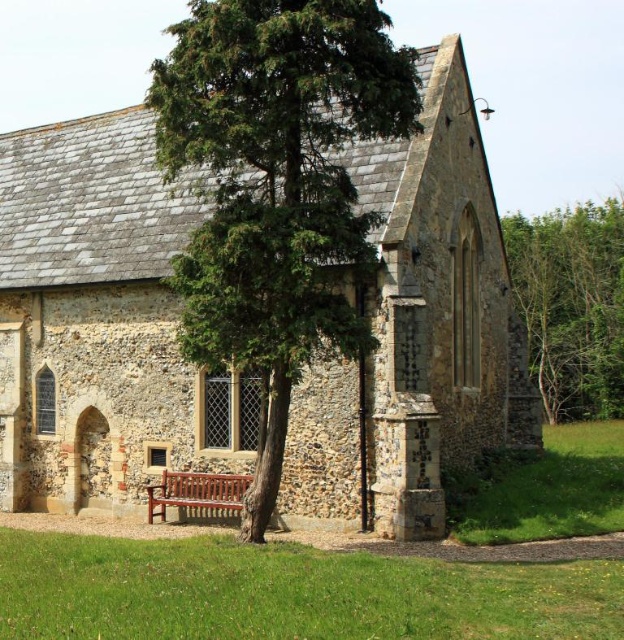
Is green textured tree at center positioned in front of polished wood bench at center?

Yes, it is.

Who is positioned more to the left, green textured tree at center or polished wood bench at center?

From the viewer's perspective, green textured tree at center appears more on the left side.

Identify the location of green textured tree at center. (276, 188).

Can you confirm if green textured tree at center is smaller than green leafy tree at right?

No, green textured tree at center is not smaller than green leafy tree at right.

Is the position of green textured tree at center more distant than that of green leafy tree at right?

No, it is not.

You are a GUI agent. You are given a task and a screenshot of the screen. Output one action in this format:
    pyautogui.click(x=<x>, y=<y>)
    Task: Click on the green textured tree at center
    The image size is (624, 640).
    Given the screenshot: What is the action you would take?
    pyautogui.click(x=276, y=188)

Does green leafy tree at right appear on the right side of polished wood bench at center?

Correct, you'll find green leafy tree at right to the right of polished wood bench at center.

Between point (600, 396) and point (241, 477), which one is positioned in front?

Point (241, 477) is in front.

The width and height of the screenshot is (624, 640). I want to click on green leafy tree at right, so click(x=572, y=305).

Where is `green leafy tree at right`? The image size is (624, 640). green leafy tree at right is located at coordinates (572, 305).